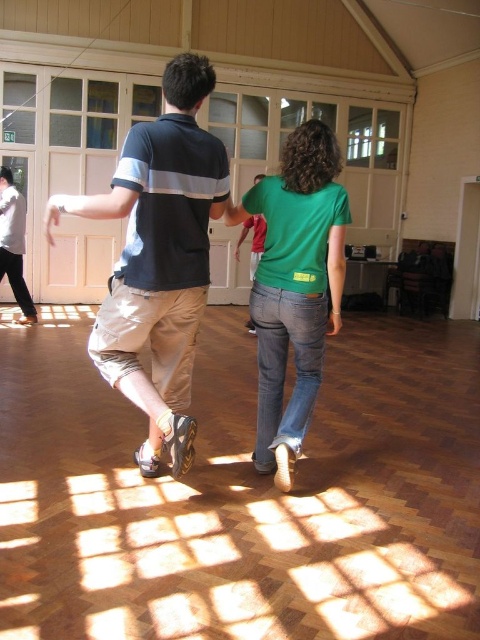
Looking at this image, you are organizing a clothing display and need to place the matte black polo shirt at center and the green cotton shirt at center on a mannequin. Which shirt should you put on first to ensure proper layering?

The matte black polo shirt at center is larger than the green cotton shirt at center, so you should place the matte black polo shirt at center first to layer the smaller green cotton shirt at center over it.

You are organizing a clothing display and need to place the matte black polo shirt at center and the green cotton shirt at center side by side. Based on their sizes, which one should be placed first to ensure they fit properly?

The matte black polo shirt at center has a larger width than the green cotton shirt at center, so it should be placed first to accommodate its size.